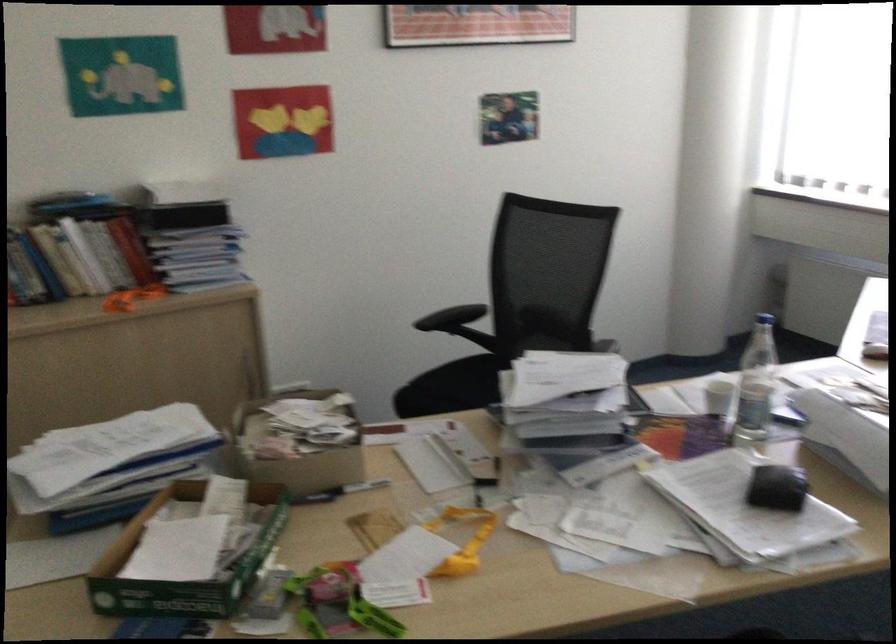
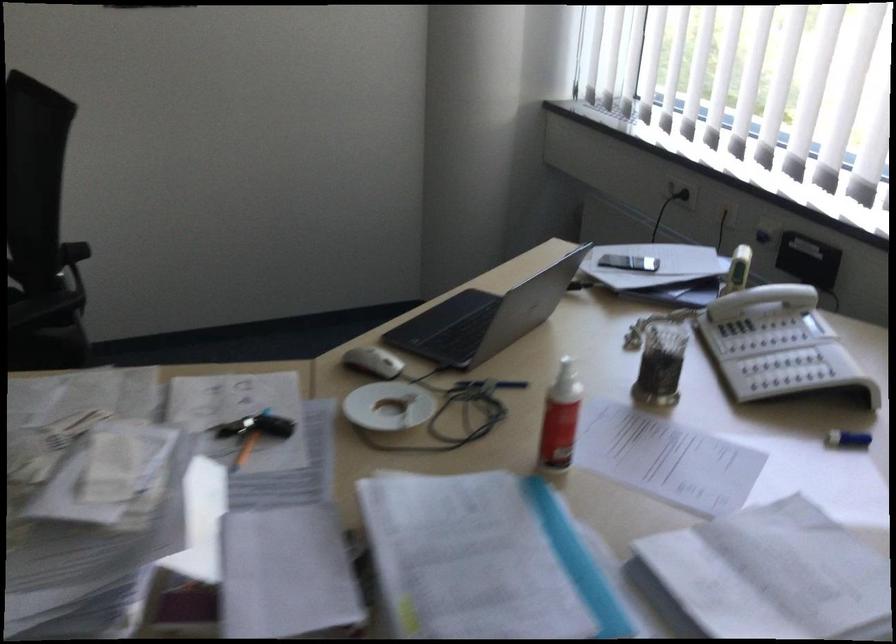
In the second image, find the point that corresponds to the point at 561,308 in the first image.

(73, 252)